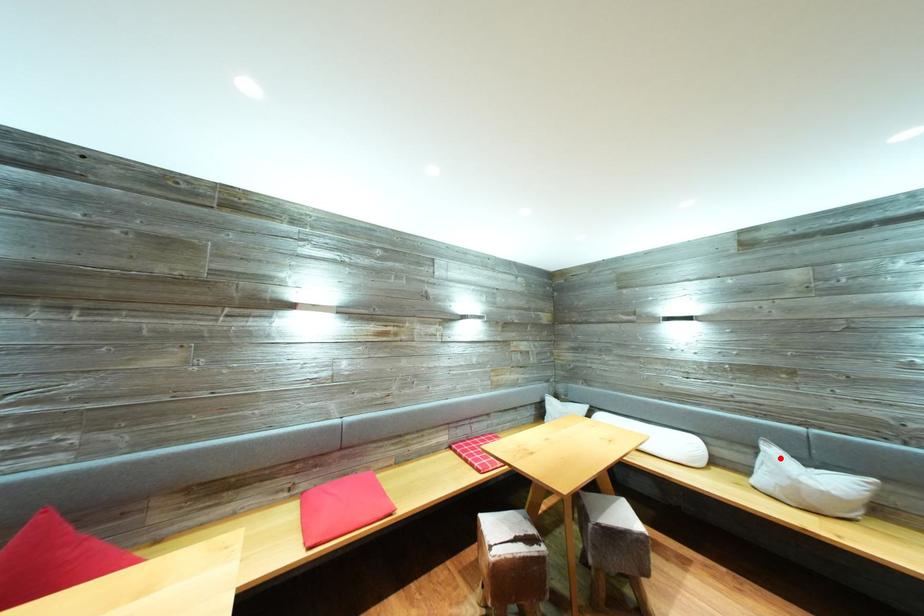
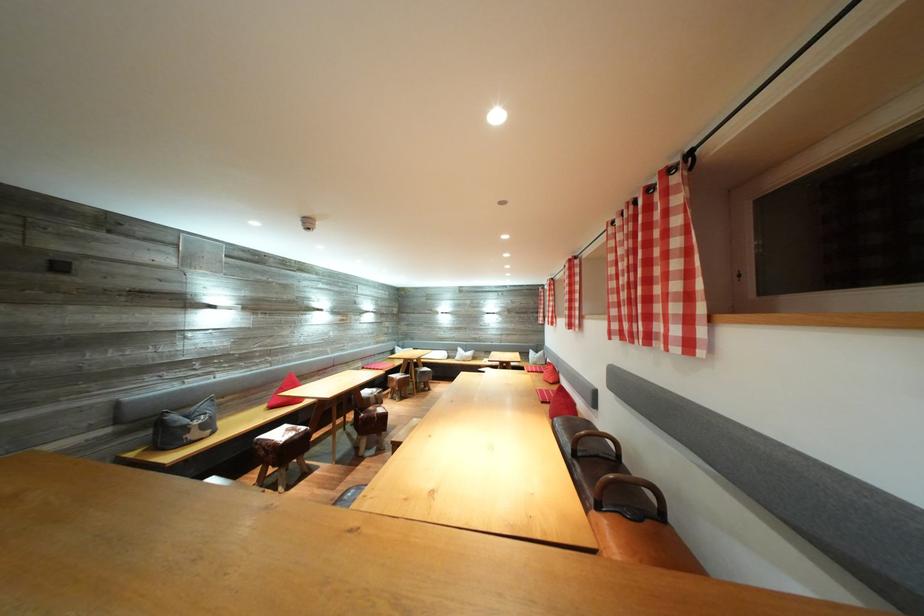
Locate, in the second image, the point that corresponds to the highlighted location in the first image.

(467, 355)